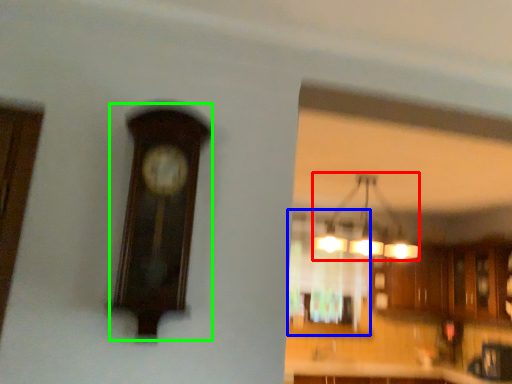
Question: Estimate the real-world distances between objects in this image. Which object is closer to lamp (highlighted by a red box), window (highlighted by a blue box) or clock (highlighted by a green box)?

Choices:
 (A) window
 (B) clock

Answer: (A)